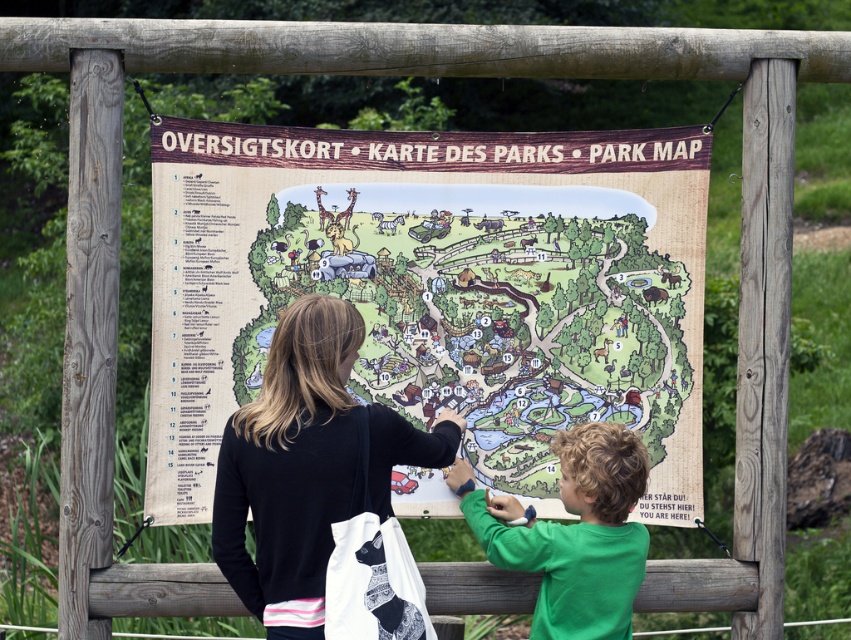
Who is taller, black fabric bag at center or green matte shirt at lower right?

black fabric bag at center is taller.

Describe the element at coordinates (307, 465) in the screenshot. I see `black fabric bag at center` at that location.

Between point (409, 429) and point (577, 636), which one is positioned behind?

The point (577, 636) is behind.

The width and height of the screenshot is (851, 640). What are the coordinates of `black fabric bag at center` in the screenshot? It's located at (307, 465).

Can you confirm if cartoon paper map at center is taller than green matte shirt at lower right?

Correct, cartoon paper map at center is much taller as green matte shirt at lower right.

Is point (417, 244) farther from camera compared to point (607, 513)?

Yes, it is.

Identify the location of cartoon paper map at center. (486, 308).

This screenshot has width=851, height=640. What do you see at coordinates (486, 308) in the screenshot? I see `cartoon paper map at center` at bounding box center [486, 308].

The width and height of the screenshot is (851, 640). I want to click on cartoon paper map at center, so click(x=486, y=308).

What do you see at coordinates (486, 308) in the screenshot?
I see `cartoon paper map at center` at bounding box center [486, 308].

The width and height of the screenshot is (851, 640). Identify the location of cartoon paper map at center. (486, 308).